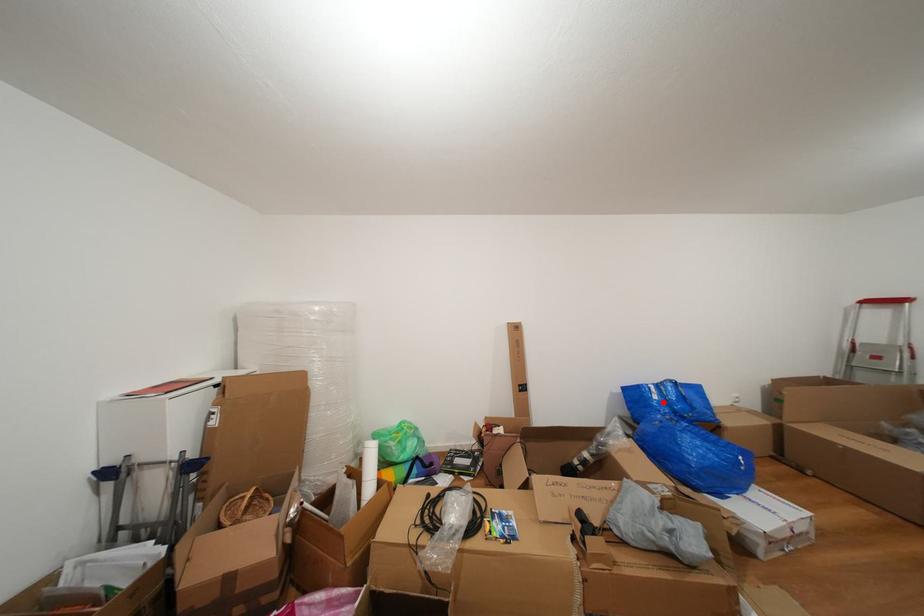
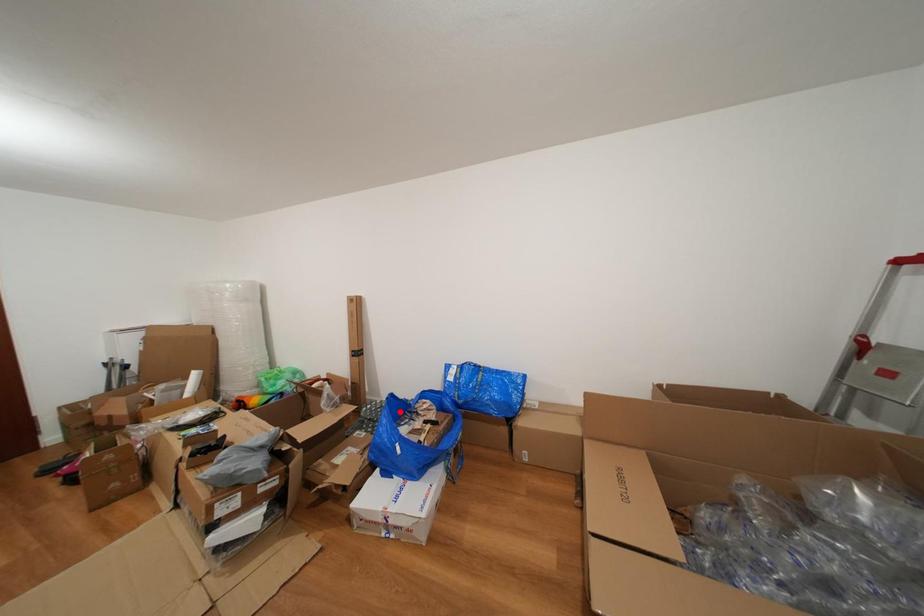
Looking at this image, I am providing you with two images of the same scene from different viewpoints. A red point is marked on the first image and another point is marked on the second image. Is the red point in image1 aligned with the point shown in image2?

No